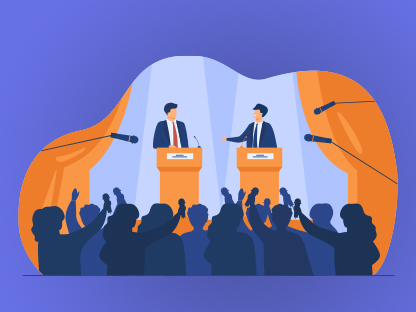
Image resolution: width=416 pixels, height=312 pixels. In order to click on podium in this screenshot , I will do `click(186, 172)`, `click(264, 175)`.